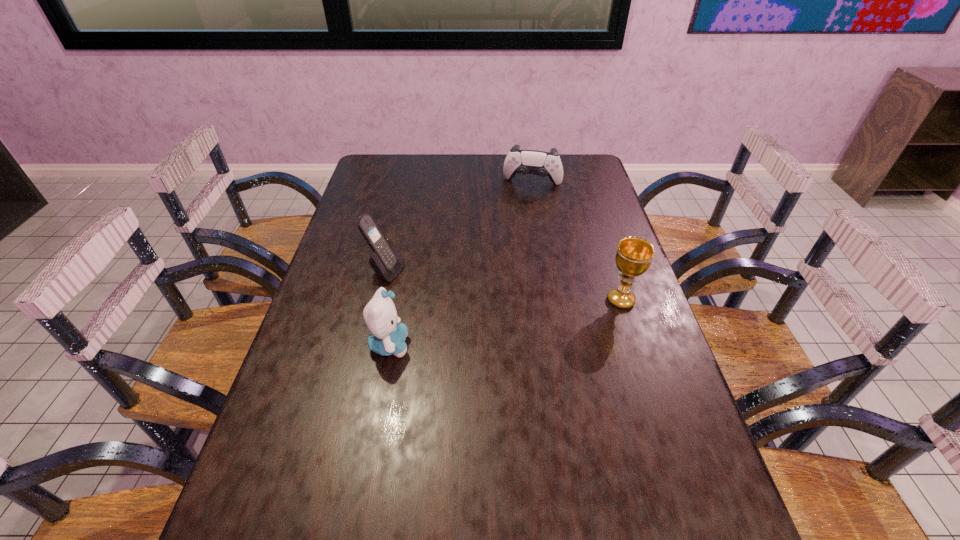
Image resolution: width=960 pixels, height=540 pixels. Find the location of `vacant space situated on the front-facing side of the farthest object`. vacant space situated on the front-facing side of the farthest object is located at coordinates (525, 206).

Locate an element on the screen. Image resolution: width=960 pixels, height=540 pixels. free space located on the front-facing side of the third nearest object is located at coordinates (492, 306).

This screenshot has width=960, height=540. Find the location of `vacant space located 0.060m on the front-facing side of the third nearest object`. vacant space located 0.060m on the front-facing side of the third nearest object is located at coordinates (420, 283).

The image size is (960, 540). I want to click on vacant space located on the front-facing side of the third nearest object, so click(523, 316).

This screenshot has width=960, height=540. Identify the location of object located at the far edge. (523, 162).

Identify the location of object at the left edge. The image size is (960, 540). (386, 261).

Where is `chalice at the right edge`? The width and height of the screenshot is (960, 540). chalice at the right edge is located at coordinates (634, 255).

This screenshot has width=960, height=540. What are the coordinates of `control positioned at the right edge` in the screenshot? It's located at (523, 162).

Identify the location of object that is at the far right corner. This screenshot has width=960, height=540. (523, 162).

Identify the location of free space at the far edge. (485, 179).